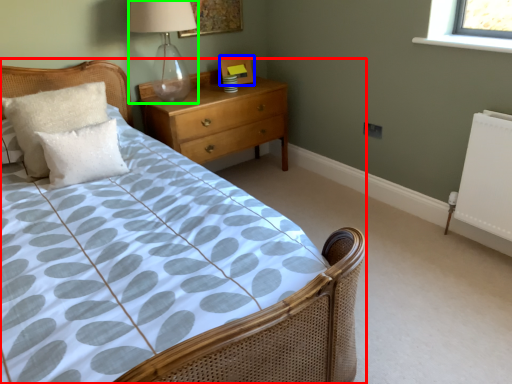
Question: Based on their relative distances, which object is nearer to bed (highlighted by a red box)? Choose from picture frame (highlighted by a blue box) and table lamp (highlighted by a green box).

Choices:
 (A) picture frame
 (B) table lamp

Answer: (A)